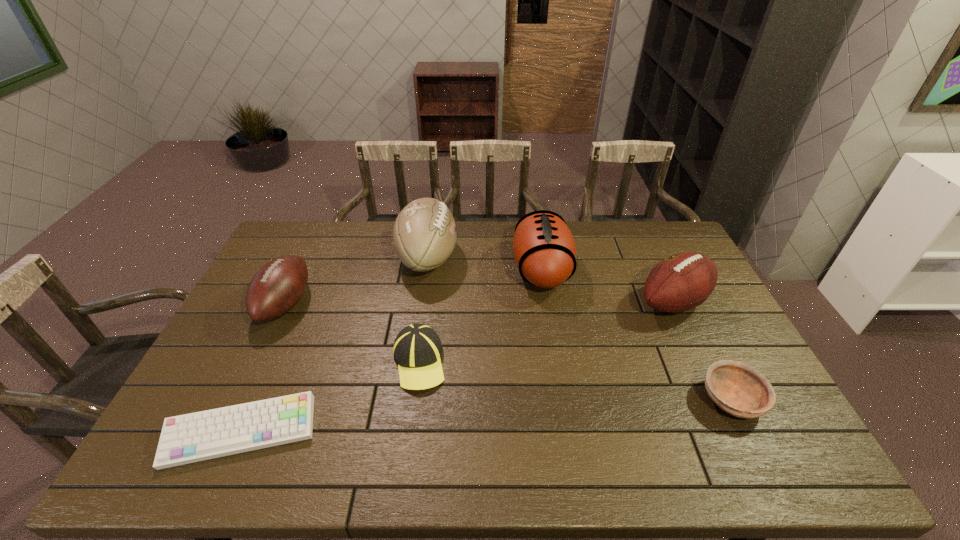
Identify the location of free region located on the left of the rightmost football (American). (520, 302).

Find the location of a particular element. This screenshot has height=540, width=960. free space located on the back of the fourth shortest object is located at coordinates (306, 259).

The image size is (960, 540). I want to click on vacant region located with the brim of the baseball cap facing forward, so click(409, 440).

This screenshot has width=960, height=540. I want to click on vacant space located on the back of the bowl, so click(x=684, y=305).

The width and height of the screenshot is (960, 540). Find the location of `free location located 0.320m on the back of the shortest object`. free location located 0.320m on the back of the shortest object is located at coordinates (296, 310).

What are the coordinates of `object that is at the near edge` in the screenshot? It's located at (194, 437).

Locate an element on the screen. football (American) at the left edge is located at coordinates (277, 287).

This screenshot has width=960, height=540. Find the location of `computer keyboard that is at the left edge`. computer keyboard that is at the left edge is located at coordinates (194, 437).

At what (x,y) coordinates should I click in order to perform the action: click on football (American) situated at the right edge. Please return your answer as a coordinate pair (x, y). Image resolution: width=960 pixels, height=540 pixels. Looking at the image, I should click on (683, 281).

Locate an element on the screen. bowl at the right edge is located at coordinates (740, 390).